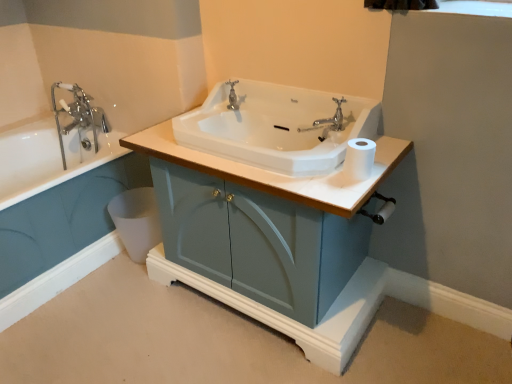
Image resolution: width=512 pixels, height=384 pixels. Identify the location of vacant space situated on the left part of white matte toilet paper at right. (309, 175).